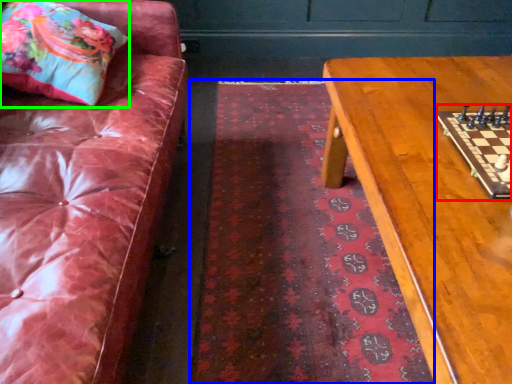
Question: Which object is the farthest from board game (highlighted by a red box)? Choose among these: mat (highlighted by a blue box) or throw pillow (highlighted by a green box).

Choices:
 (A) mat
 (B) throw pillow

Answer: (B)